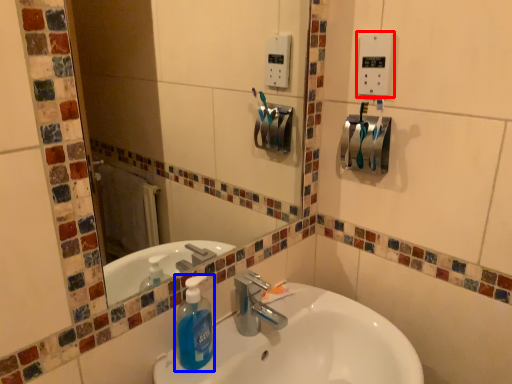
Question: Which object is closer to the camera taking this photo, light switch (highlighted by a red box) or cleaning product (highlighted by a blue box)?

Choices:
 (A) light switch
 (B) cleaning product

Answer: (B)